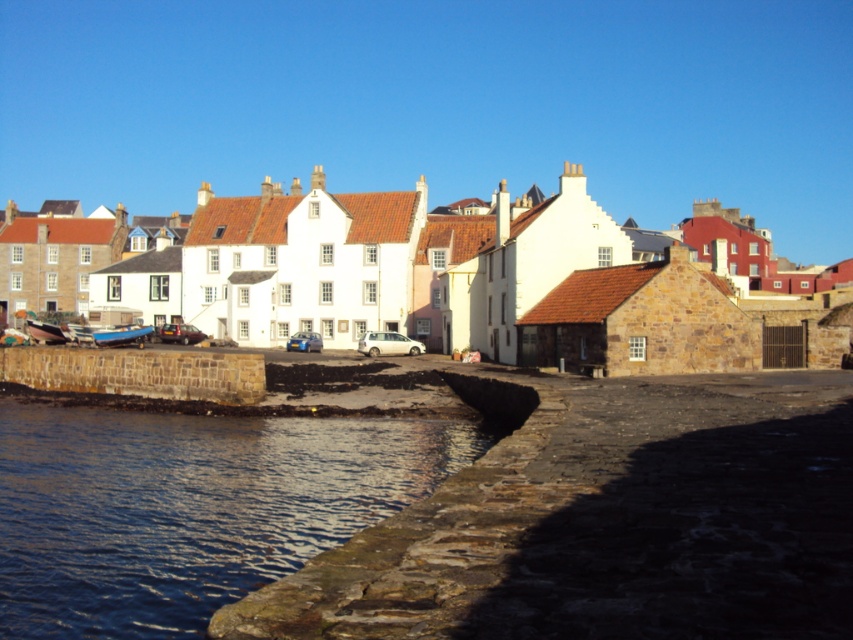
How distant is white stone houses at center from brown stone wall at lower left?

white stone houses at center and brown stone wall at lower left are 138.01 feet apart.

Does white stone houses at center have a larger size compared to brown stone wall at lower left?

Yes.

At what (x,y) coordinates should I click in order to perform the action: click on white stone houses at center. Please return your answer as a coordinate pair (x, y). Looking at the image, I should click on (482, 280).

Where is `white stone houses at center`? The image size is (853, 640). white stone houses at center is located at coordinates (482, 280).

Between point (218, 548) and point (134, 332), which one is positioned in front?

Point (218, 548) is in front.

Does clear water at lower left come in front of metallic blue boat at lower left?

Yes, clear water at lower left is in front of metallic blue boat at lower left.

Is point (0, 588) closer to camera compared to point (134, 326)?

Yes.

At what (x,y) coordinates should I click in order to perform the action: click on clear water at lower left. Please return your answer as a coordinate pair (x, y). The height and width of the screenshot is (640, 853). Looking at the image, I should click on (189, 508).

Who is lower down, white stone houses at center or metallic blue boat at lower left?

metallic blue boat at lower left is below.

Which of these two, white stone houses at center or metallic blue boat at lower left, stands shorter?

metallic blue boat at lower left

I want to click on white stone houses at center, so pyautogui.click(x=482, y=280).